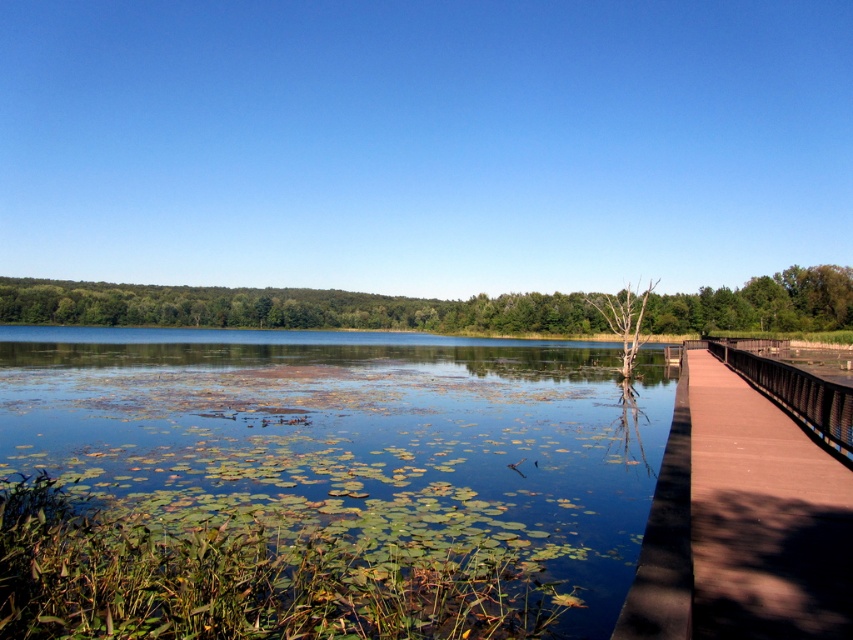
You are standing on the dock and want to know which object in the scene is taller when viewed from your position. Which one is taller between the green leafy water at center and the brown wooden bridge at right?

The green leafy water at center is taller than the brown wooden bridge at right.

You are standing on the wooden dock and looking towards the center of the lake. You see the green leafy water at center and the green leafy tree at center. Which one is closer to you?

The green leafy water at center is positioned under green leafy tree at center, so the water is closer to you than the tree.

You are standing on the brown wooden bridge at right and want to see the green leafy water at center. In which direction should you look to see it?

The green leafy water at center is located below the brown wooden bridge at right, so you should look downward to see it.